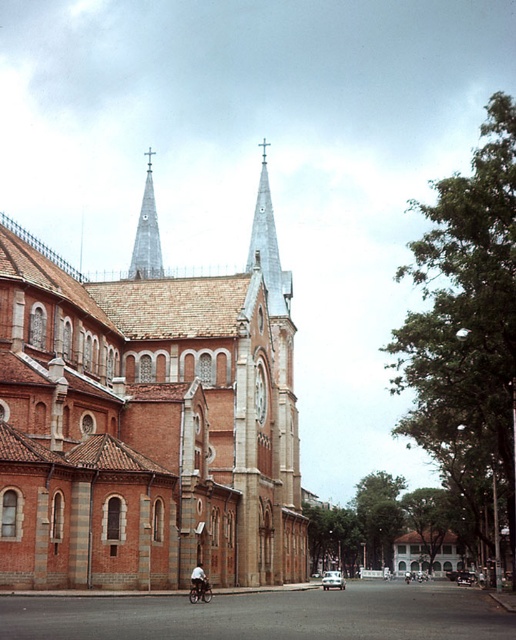
Between brick textured church at center and shiny silver spire at upper center, which one is positioned higher?

shiny silver spire at upper center

Which is behind, point (202, 548) or point (139, 230)?

Positioned behind is point (139, 230).

Between point (6, 461) and point (140, 262), which one is positioned behind?

Positioned behind is point (140, 262).

This screenshot has width=516, height=640. I want to click on brick textured church at center, so click(x=149, y=422).

Between brick textured church at center and silver metallic bicycle at center, which one is positioned lower?

Positioned lower is silver metallic bicycle at center.

Is brick textured church at center shorter than silver metallic bicycle at center?

In fact, brick textured church at center may be taller than silver metallic bicycle at center.

Locate an element on the screen. The image size is (516, 640). brick textured church at center is located at coordinates (149, 422).

This screenshot has width=516, height=640. I want to click on brick textured church at center, so click(149, 422).

Measure the distance between point (146, 184) and camera.

Point (146, 184) and camera are 180.69 meters apart from each other.

Can you confirm if shiny silver spire at upper center is positioned below dark blue fabric shirt at lower center?

No, shiny silver spire at upper center is not below dark blue fabric shirt at lower center.

Where is `shiny silver spire at upper center`? This screenshot has width=516, height=640. shiny silver spire at upper center is located at coordinates (147, 234).

Locate an element on the screen. Image resolution: width=516 pixels, height=640 pixels. shiny silver spire at upper center is located at coordinates (147, 234).